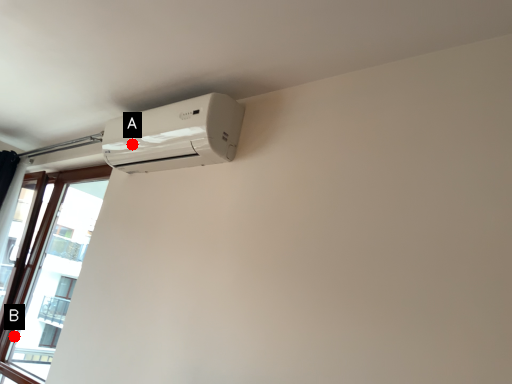
Question: Two points are circled on the image, labeled by A and B beside each circle. Which point is further to the camera?

Choices:
 (A) A is further
 (B) B is further

Answer: (B)